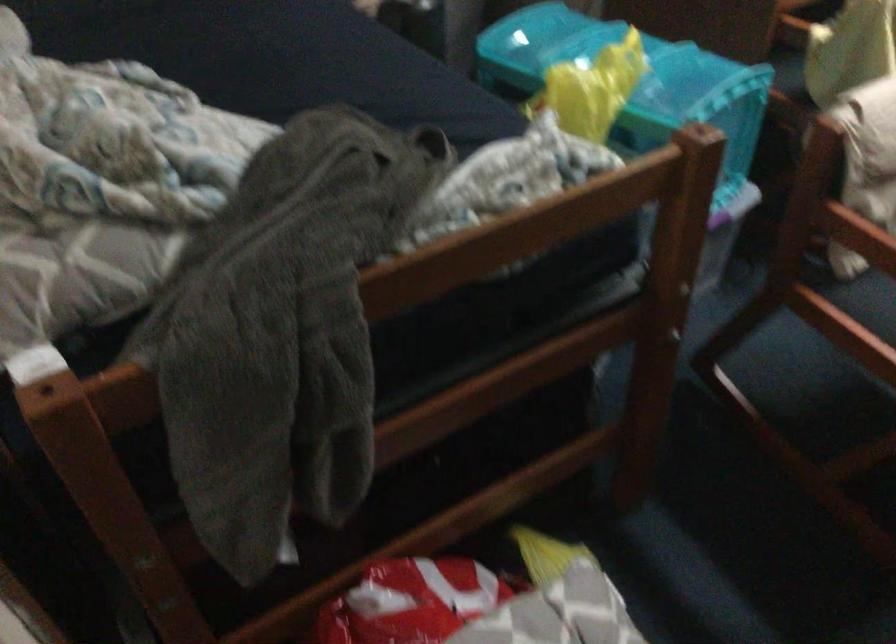
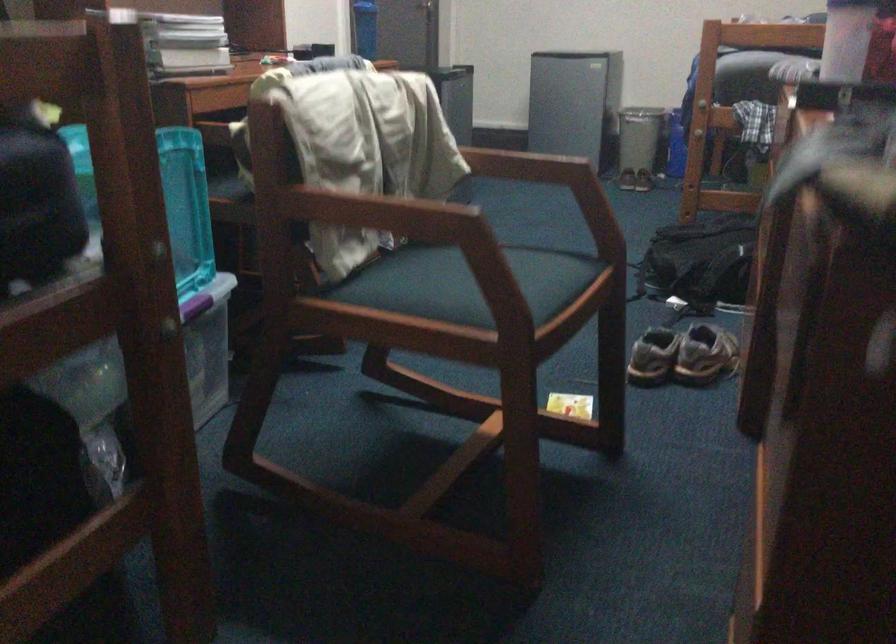
Question: The camera is either moving clockwise (left) or counter-clockwise (right) around the object. The first image is from the beginning of the video and the second image is from the end. Is the camera moving left or right when shooting the video?

Choices:
 (A) Left
 (B) Right

Answer: (A)